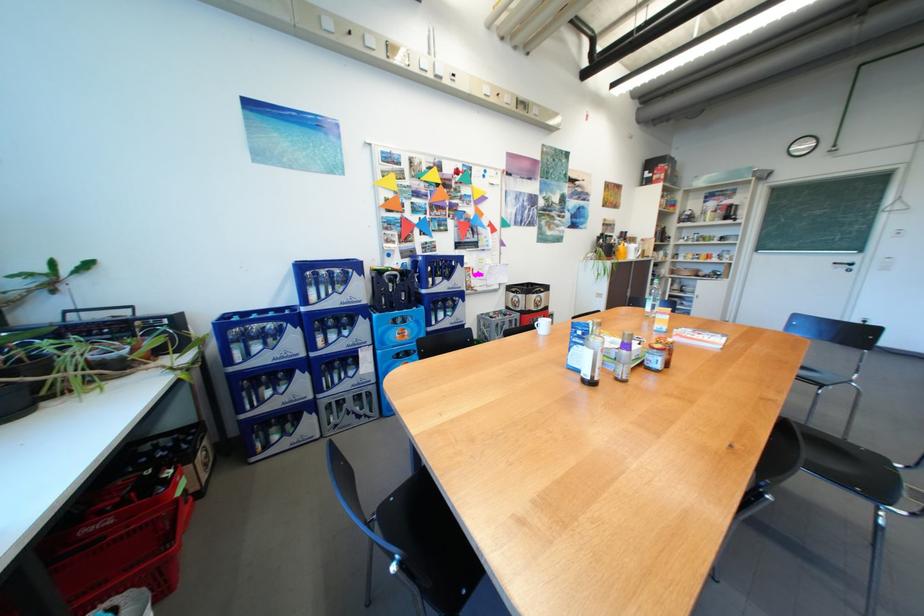
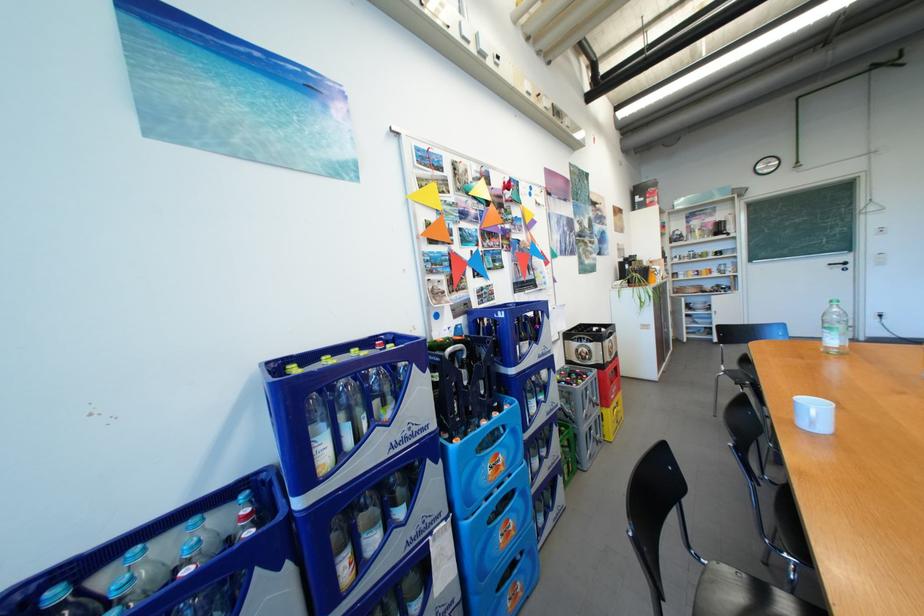
The images are taken continuously from a first-person perspective. In which direction are you moving?

The movement direction of the cameraman is left, forward.